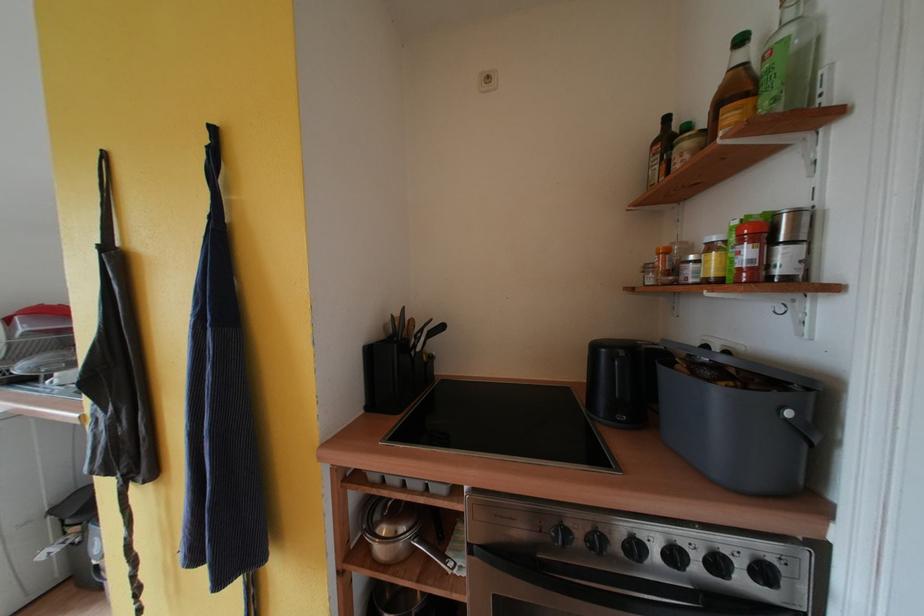
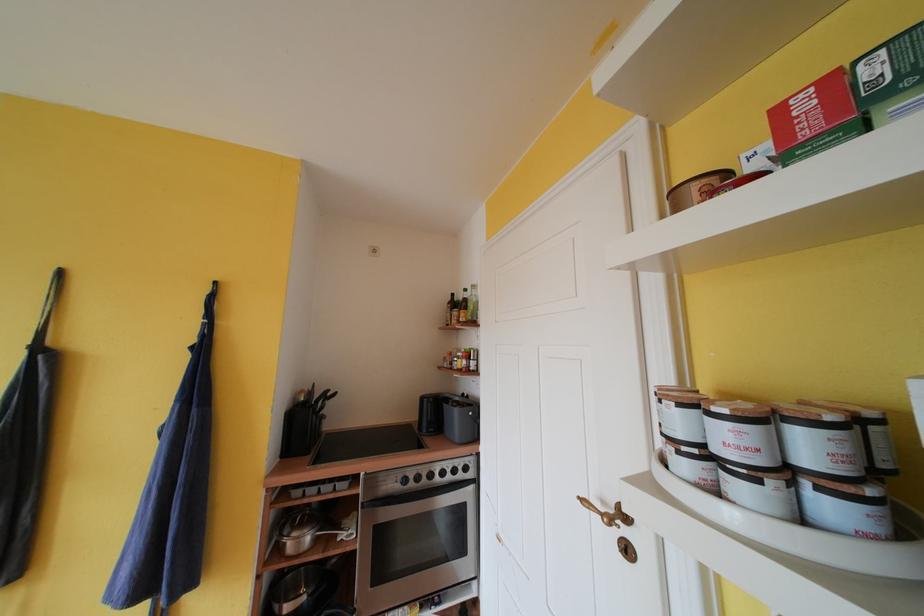
Where in the second image is the point corresponding to the point at 748,44 from the first image?

(471, 294)